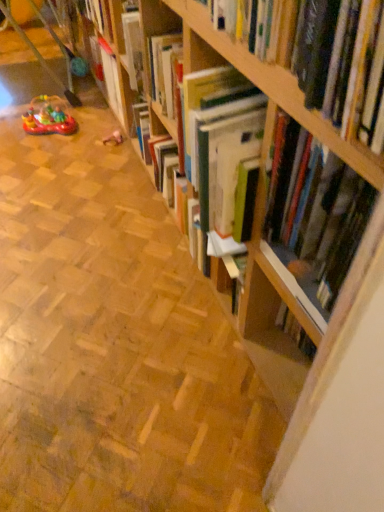
Identify the location of vacant area on the back side of rubberized plastic toy at center, which is the first toy in right-to-left order. (106, 128).